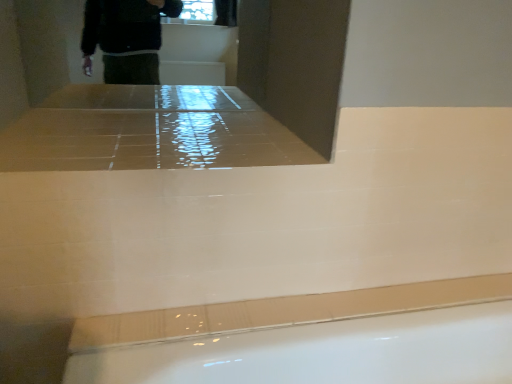
What do you see at coordinates (324, 352) in the screenshot? Image resolution: width=512 pixels, height=384 pixels. I see `white glossy bath at lower center` at bounding box center [324, 352].

Find the location of a particular element. white glossy bath at lower center is located at coordinates (324, 352).

Identify the location of white glossy bath at lower center. The width and height of the screenshot is (512, 384). (324, 352).